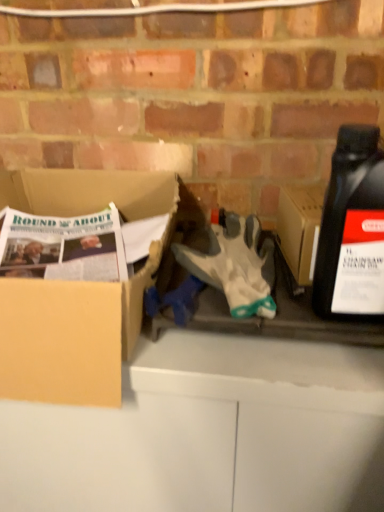
What are the coordinates of `cardboard box at left` in the screenshot? It's located at (77, 291).

Is cardboard box at left oriented away from white fabric glove at center?

That's not correct — cardboard box at left is not looking away from white fabric glove at center.

Can you confirm if cardboard box at left is positioned to the left of white fabric glove at center?

Yes.

How distant is cardboard box at left from white fabric glove at center?

5.82 inches.

Is cardboard box at left far away from white fabric glove at center?

That's not correct — cardboard box at left is a little close to white fabric glove at center.

Could you tell me if black plastic bottle at right is turned towards cardboard box at left?

No, black plastic bottle at right is not facing towards cardboard box at left.

Is black plastic bottle at right to the left or to the right of cardboard box at left in the image?

black plastic bottle at right is to the right of cardboard box at left.

Between black plastic bottle at right and cardboard box at left, which one has larger size?

cardboard box at left.

Considering the positions of objects cardboard box at left and black plastic bottle at right in the image provided, who is more to the right, cardboard box at left or black plastic bottle at right?

From the viewer's perspective, black plastic bottle at right appears more on the right side.

In the scene shown: From a real-world perspective, between cardboard box at left and black plastic bottle at right, who is vertically higher?

black plastic bottle at right, from a real-world perspective.

From the image's perspective, is cardboard box at left on top of black plastic bottle at right?

No, from the image's perspective, cardboard box at left is not on top of black plastic bottle at right.

Measure the distance from cardboard box at left to black plastic bottle at right.

cardboard box at left is 10.56 inches away from black plastic bottle at right.

From a real-world perspective, is white fabric glove at center on cardboard box at left?

Yes, from a real-world perspective, white fabric glove at center is over cardboard box at left

Is white fabric glove at center oriented away from cardboard box at left?

No, white fabric glove at center is not facing the opposite direction of cardboard box at left.

How many degrees apart are the facing directions of white fabric glove at center and cardboard box at left?

10.3 degrees separate the facing orientations of white fabric glove at center and cardboard box at left.

Are white fabric glove at center and cardboard box at left located far from each other?

No, white fabric glove at center is not far away from cardboard box at left.

At what (x,y) coordinates should I click in order to perform the action: click on glove that is behind the black plastic bottle at right. Please return your answer as a coordinate pair (x, y). The width and height of the screenshot is (384, 512). Looking at the image, I should click on (234, 264).

In terms of height, does black plastic bottle at right look taller or shorter compared to white fabric glove at center?

Considering their sizes, black plastic bottle at right has more height than white fabric glove at center.

From the image's perspective, between white fabric glove at center and black plastic bottle at right, who is located below?

white fabric glove at center is shown below in the image.

Is white fabric glove at center closer to camera compared to black plastic bottle at right?

No, white fabric glove at center is further to the viewer.

What's the angular difference between white fabric glove at center and black plastic bottle at right's facing directions?

The angular difference between white fabric glove at center and black plastic bottle at right is 9.02 degrees.

From a real-world perspective, is white fabric glove at center positioned over black plastic bottle at right based on gravity?

Incorrect, from a real-world perspective, white fabric glove at center is lower than black plastic bottle at right.

I want to click on glove lying below the cardboard box at left (from the image's perspective), so click(x=234, y=264).

Where is `box behind the black plastic bottle at right`? The image size is (384, 512). box behind the black plastic bottle at right is located at coordinates (77, 291).

When comparing their distances from cardboard box at left, does white fabric glove at center or black plastic bottle at right seem closer?

Among the two, white fabric glove at center is located nearer to cardboard box at left.

Which object lies nearer to the anchor point cardboard box at left, black plastic bottle at right or white fabric glove at center?

white fabric glove at center is positioned closer to the anchor cardboard box at left.

Estimate the real-world distances between objects in this image. Which object is closer to black plastic bottle at right, cardboard box at left or white fabric glove at center?

white fabric glove at center lies closer to black plastic bottle at right than the other object.

Considering their positions, is black plastic bottle at right positioned further to white fabric glove at center than cardboard box at left?

cardboard box at left is further to white fabric glove at center.

When comparing their distances from white fabric glove at center, does cardboard box at left or black plastic bottle at right seem closer?

Among the two, black plastic bottle at right is located nearer to white fabric glove at center.

Estimate the real-world distances between objects in this image. Which object is further from black plastic bottle at right, white fabric glove at center or cardboard box at left?

cardboard box at left.

The image size is (384, 512). I want to click on glove between cardboard box at left and black plastic bottle at right, so click(x=234, y=264).